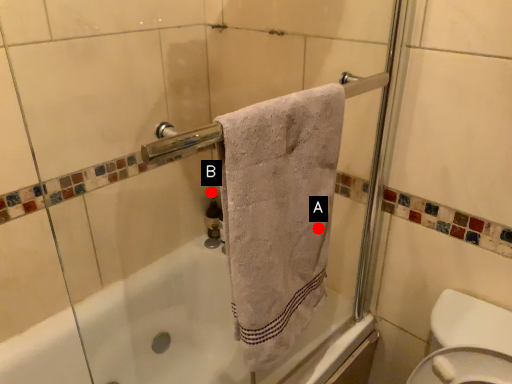
Question: Two points are circled on the image, labeled by A and B beside each circle. Which point appears closest to the camera in this image?

Choices:
 (A) A is closer
 (B) B is closer

Answer: (A)